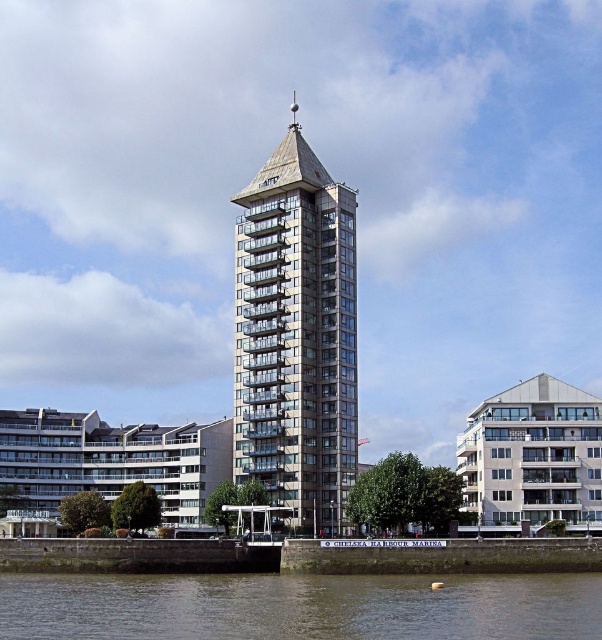
Question: In this image, where is metallic glass tower at center located relative to brown water at lower center?

Choices:
 (A) right
 (B) left

Answer: (B)

Question: Among these objects, which one is farthest from the camera?

Choices:
 (A) metallic glass tower at center
 (B) brown water at lower center

Answer: (A)

Question: Among these points, which one is farthest from the camera?

Choices:
 (A) (312, 372)
 (B) (314, 604)

Answer: (A)

Question: Is metallic glass tower at center thinner than brown water at lower center?

Choices:
 (A) no
 (B) yes

Answer: (B)

Question: Which object appears farthest from the camera in this image?

Choices:
 (A) brown water at lower center
 (B) metallic glass tower at center

Answer: (B)

Question: Is metallic glass tower at center bigger than brown water at lower center?

Choices:
 (A) yes
 (B) no

Answer: (A)